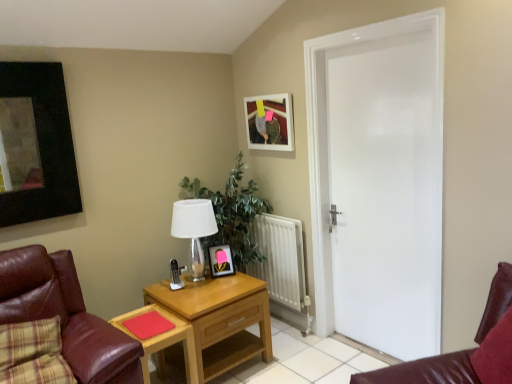
The height and width of the screenshot is (384, 512). What are the coordinates of `free space above wooden table at center (from a real-world perspective)` in the screenshot? It's located at (150, 323).